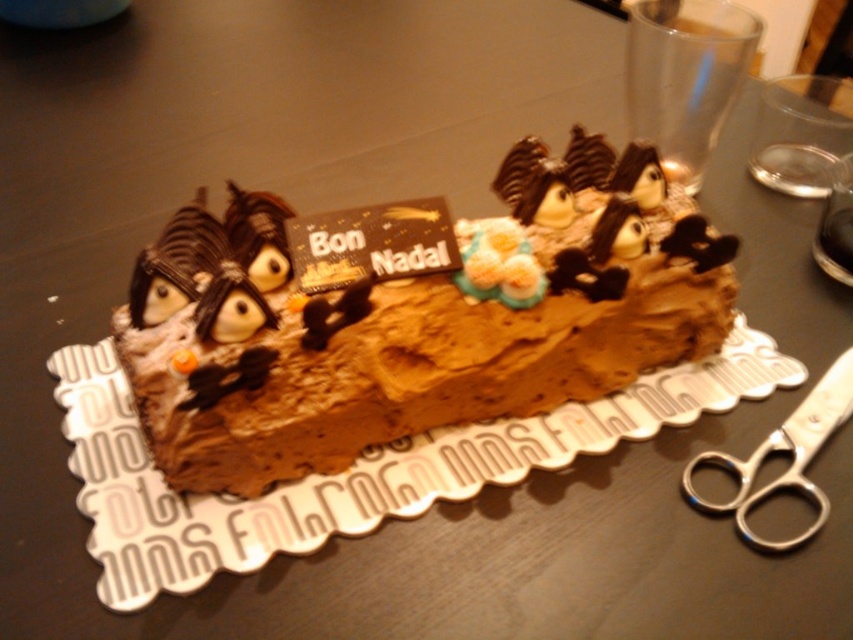
Question: Can you confirm if chocolate frosted cake at center is bigger than silver metallic scissors at lower right?

Choices:
 (A) no
 (B) yes

Answer: (B)

Question: Which point is closer to the camera?

Choices:
 (A) chocolate frosted cake at center
 (B) silver metallic scissors at lower right

Answer: (A)

Question: Which point is closer to the camera?

Choices:
 (A) chocolate frosted cake at center
 (B) silver metallic scissors at lower right

Answer: (A)

Question: Is chocolate frosted cake at center smaller than silver metallic scissors at lower right?

Choices:
 (A) no
 (B) yes

Answer: (A)

Question: From the image, what is the correct spatial relationship of chocolate frosted cake at center in relation to silver metallic scissors at lower right?

Choices:
 (A) below
 (B) above

Answer: (B)